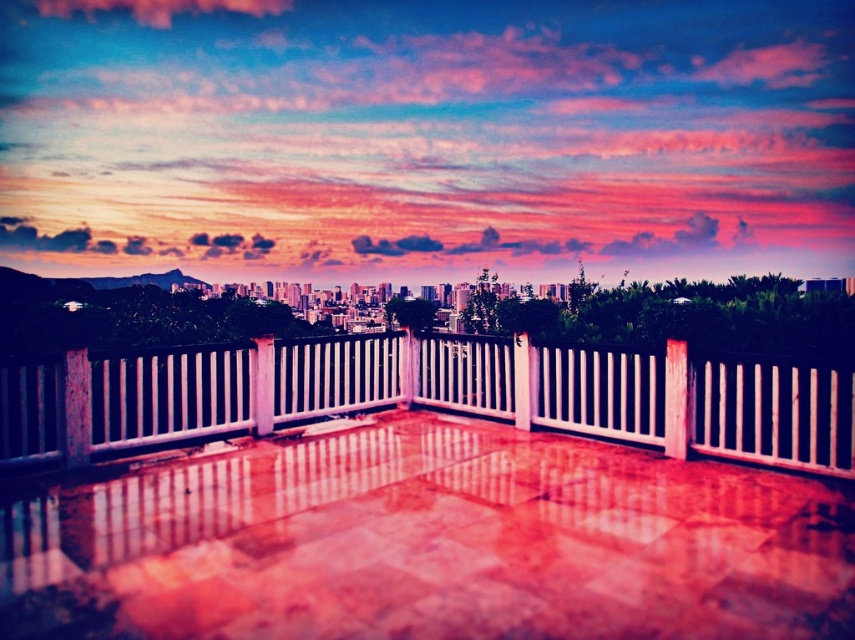
Does smooth concrete deck at center appear over white glossy fence at center?

No, smooth concrete deck at center is not above white glossy fence at center.

This screenshot has width=855, height=640. Identify the location of smooth concrete deck at center. (431, 544).

This screenshot has width=855, height=640. What do you see at coordinates (431, 544) in the screenshot?
I see `smooth concrete deck at center` at bounding box center [431, 544].

What are the coordinates of `smooth concrete deck at center` in the screenshot? It's located at (431, 544).